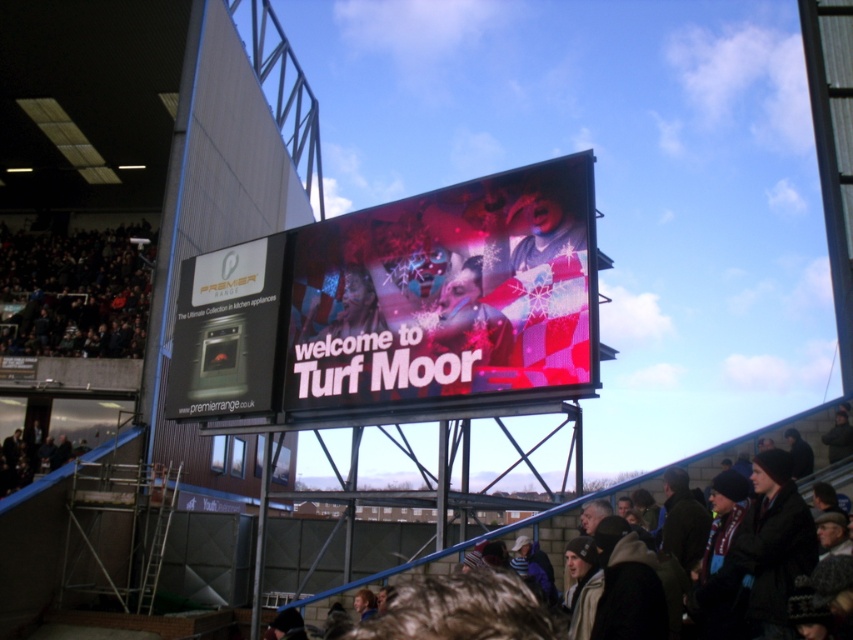
Is shiny digital screen at center shorter than dark brown fabric at upper left?

Correct, shiny digital screen at center is not as tall as dark brown fabric at upper left.

Who is more forward, (466, 381) or (119, 269)?

Point (466, 381) is in front.

Image resolution: width=853 pixels, height=640 pixels. Identify the location of shiny digital screen at center. (398, 304).

Find the location of a particular element. The height and width of the screenshot is (640, 853). shiny digital screen at center is located at coordinates (398, 304).

Who is lower down, dark brown fabric at upper left or matte black oven at center-left?

matte black oven at center-left is below.

Is dark brown fabric at upper left shorter than matte black oven at center-left?

No.

Measure the distance between point (91, 244) and camera.

A distance of 311.82 feet exists between point (91, 244) and camera.

The image size is (853, 640). I want to click on dark brown fabric at upper left, so click(x=74, y=292).

Is point (498, 310) farther from camera compared to point (13, 483)?

That is False.

Image resolution: width=853 pixels, height=640 pixels. Find the location of `shiny metallic helmet at center`. shiny metallic helmet at center is located at coordinates (469, 317).